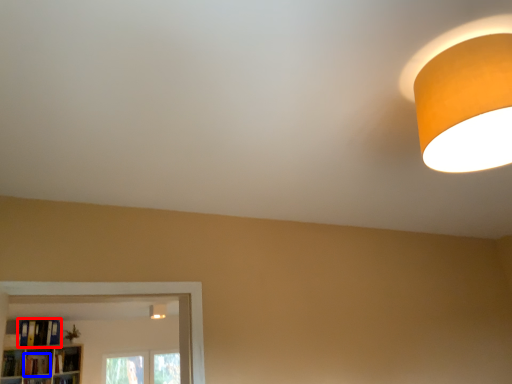
Question: Which object is further to the camera taking this photo, book (highlighted by a red box) or book (highlighted by a blue box)?

Choices:
 (A) book
 (B) book

Answer: (B)